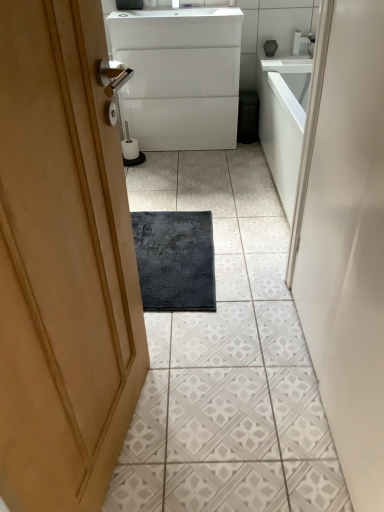
Question: From the image's perspective, does white glossy cabinet at center appear lower than white glossy tap at upper center?

Choices:
 (A) no
 (B) yes

Answer: (B)

Question: Considering the relative sizes of white glossy cabinet at center and white glossy tap at upper center in the image provided, is white glossy cabinet at center thinner than white glossy tap at upper center?

Choices:
 (A) yes
 (B) no

Answer: (B)

Question: Is white glossy tap at upper center surrounded by white glossy cabinet at center?

Choices:
 (A) yes
 (B) no

Answer: (B)

Question: From a real-world perspective, is white glossy cabinet at center positioned under white glossy tap at upper center based on gravity?

Choices:
 (A) yes
 (B) no

Answer: (A)

Question: Can you confirm if white glossy cabinet at center is shorter than white glossy tap at upper center?

Choices:
 (A) yes
 (B) no

Answer: (B)

Question: In terms of width, does white glossy countertop at upper center look wider or thinner when compared to white glossy faucet at upper center?

Choices:
 (A) wide
 (B) thin

Answer: (B)

Question: Is white glossy countertop at upper center to the left or to the right of white glossy faucet at upper center in the image?

Choices:
 (A) left
 (B) right

Answer: (B)

Question: Is white glossy countertop at upper center spatially inside white glossy faucet at upper center, or outside of it?

Choices:
 (A) inside
 (B) outside

Answer: (B)

Question: From a real-world perspective, is white glossy countertop at upper center above or below white glossy faucet at upper center?

Choices:
 (A) above
 (B) below

Answer: (B)

Question: From their relative heights in the image, would you say white glossy countertop at upper center is taller or shorter than white glossy tap at upper center?

Choices:
 (A) tall
 (B) short

Answer: (B)

Question: Looking at their shapes, would you say white glossy countertop at upper center is wider or thinner than white glossy tap at upper center?

Choices:
 (A) thin
 (B) wide

Answer: (B)

Question: Considering the positions of point (299, 61) and point (311, 36), is point (299, 61) closer or farther from the camera than point (311, 36)?

Choices:
 (A) farther
 (B) closer

Answer: (B)

Question: Considering their positions, is white glossy countertop at upper center located in front of or behind white glossy tap at upper center?

Choices:
 (A) behind
 (B) front

Answer: (B)

Question: Visually, is white glossy tap at upper center positioned to the left or to the right of white textured tile at center?

Choices:
 (A) right
 (B) left

Answer: (A)

Question: Considering their positions, is white glossy tap at upper center located in front of or behind white textured tile at center?

Choices:
 (A) behind
 (B) front

Answer: (A)